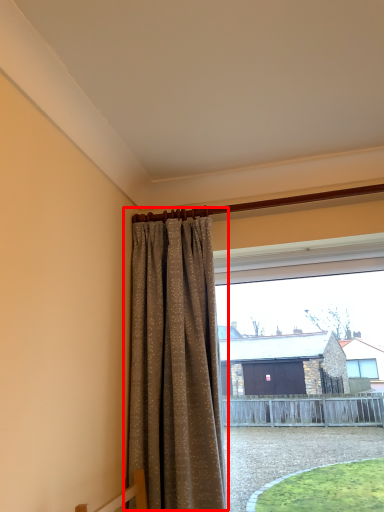
Question: From the image's perspective, what is the correct spatial positioning of curtain (annotated by the red box) in reference to window?

Choices:
 (A) above
 (B) below

Answer: (A)